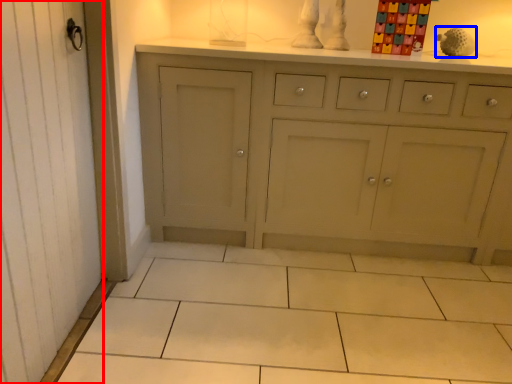
Question: Among these objects, which one is farthest to the camera, screen door (highlighted by a red box) or toy (highlighted by a blue box)?

Choices:
 (A) screen door
 (B) toy

Answer: (B)